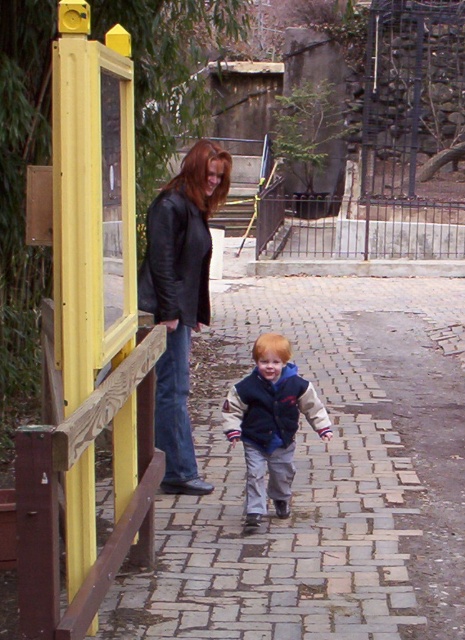
Question: Which point appears closest to the camera in this image?

Choices:
 (A) (183, 269)
 (B) (134, 561)

Answer: (B)

Question: Can you confirm if matte black leather jacket at upper left is positioned below velvet navy vest at center?

Choices:
 (A) no
 (B) yes

Answer: (A)

Question: Which is nearer to the velvet navy vest at center?

Choices:
 (A) wooden rail at left
 (B) velvet blue jacket at center
 (C) black leather jacket at upper left

Answer: (B)

Question: Can you confirm if wooden rail at left is positioned below matte black leather jacket at upper left?

Choices:
 (A) no
 (B) yes

Answer: (B)

Question: Which of the following is the closest to the observer?

Choices:
 (A) velvet blue jacket at center
 (B) wooden rail at left
 (C) black leather jacket at upper left

Answer: (B)

Question: Observing the image, what is the correct spatial positioning of wooden rail at left in reference to black leather jacket at upper left?

Choices:
 (A) above
 (B) below

Answer: (B)